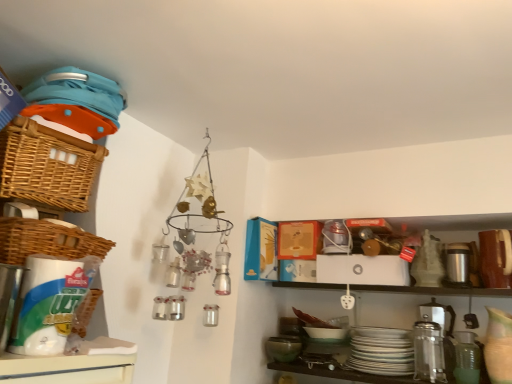
At what (x,y) coordinates should I click in order to perform the action: click on silver metallic thermos at right. Please return your answer as a coordinate pair (x, y). Looking at the image, I should click on (461, 264).

At what (x,y) coordinates should I click in order to perform the action: click on silver metallic thermos at right. Please return your answer as a coordinate pair (x, y). The image size is (512, 384). Looking at the image, I should click on (461, 264).

Is silver metallic thermos at right surrounded by woven brown basket at left, arranged as the 1th basket when ordered from the bottom?

No, silver metallic thermos at right is not a part of woven brown basket at left, arranged as the 1th basket when ordered from the bottom.

Is woven brown basket at left, the second basket positioned from the top, facing towards silver metallic thermos at right?

No, woven brown basket at left, the second basket positioned from the top, is not facing towards silver metallic thermos at right.

Considering their positions, is woven brown basket at left, the second basket positioned from the top, located in front of or behind silver metallic thermos at right?

woven brown basket at left, the second basket positioned from the top, is positioned closer to the viewer than silver metallic thermos at right.

From the image's perspective, is woven brown basket at left, the second basket positioned from the top, positioned above or below silver metallic thermos at right?

Clearly, from the image's perspective, woven brown basket at left, the second basket positioned from the top, is above silver metallic thermos at right.

Are silver metallic thermos at right and green matte mixing bowl at lower center making contact?

No, silver metallic thermos at right is not beside green matte mixing bowl at lower center.

From a real-world perspective, relative to green matte mixing bowl at lower center, is silver metallic thermos at right vertically above or below?

silver metallic thermos at right is situated higher than green matte mixing bowl at lower center in the real world.

Which of these two, silver metallic thermos at right or green matte mixing bowl at lower center, is smaller?

green matte mixing bowl at lower center.

This screenshot has width=512, height=384. Find the location of `appliance lying above the green matte mixing bowl at lower center (from the image's perspective)`. appliance lying above the green matte mixing bowl at lower center (from the image's perspective) is located at coordinates (461, 264).

Between woven brown basket at upper left, the 1th basket when ordered from top to bottom, and woven brown basket at left, arranged as the 1th basket when ordered from the bottom, which one has smaller size?

woven brown basket at left, arranged as the 1th basket when ordered from the bottom.

Locate an element on the screen. The height and width of the screenshot is (384, 512). basket above the woven brown basket at left, arranged as the 1th basket when ordered from the bottom (from the image's perspective) is located at coordinates (47, 165).

Considering the relative sizes of woven brown basket at upper left, the 1th basket when ordered from top to bottom, and woven brown basket at left, arranged as the 1th basket when ordered from the bottom, in the image provided, is woven brown basket at upper left, the 1th basket when ordered from top to bottom, shorter than woven brown basket at left, arranged as the 1th basket when ordered from the bottom,?

In fact, woven brown basket at upper left, the 1th basket when ordered from top to bottom, may be taller than woven brown basket at left, arranged as the 1th basket when ordered from the bottom.

Considering the positions of points (85, 171) and (20, 254), is point (85, 171) farther from camera compared to point (20, 254)?

Yes, point (85, 171) is farther from viewer.

Do you think woven brown basket at left, the second basket positioned from the top, is within woven brown basket at upper left, the 1th basket when ordered from top to bottom, or outside of it?

woven brown basket at left, the second basket positioned from the top, exists outside the volume of woven brown basket at upper left, the 1th basket when ordered from top to bottom.

Looking at this image, what's the angular difference between woven brown basket at left, arranged as the 1th basket when ordered from the bottom, and woven brown basket at upper left, marked as the second basket in a bottom-to-top arrangement,'s facing directions?

They differ by 0.000455 degrees in their facing directions.

From a real-world perspective, is woven brown basket at left, arranged as the 1th basket when ordered from the bottom, positioned over woven brown basket at upper left, the 1th basket when ordered from top to bottom, based on gravity?

No, from a real-world perspective, woven brown basket at left, arranged as the 1th basket when ordered from the bottom, is not above woven brown basket at upper left, the 1th basket when ordered from top to bottom.

Find the location of a particular element. basket lying on the left of woven brown basket at left, arranged as the 1th basket when ordered from the bottom is located at coordinates (47, 165).

Is green matte mixing bowl at lower center located outside silver metallic thermos at right?

Yes, green matte mixing bowl at lower center is outside of silver metallic thermos at right.

Can you confirm if green matte mixing bowl at lower center is taller than silver metallic thermos at right?

No, green matte mixing bowl at lower center is not taller than silver metallic thermos at right.

Can you confirm if woven brown basket at left, arranged as the 1th basket when ordered from the bottom, is wider than green matte mixing bowl at lower center?

Correct, the width of woven brown basket at left, arranged as the 1th basket when ordered from the bottom, exceeds that of green matte mixing bowl at lower center.

How different are the orientations of woven brown basket at left, the second basket positioned from the top, and green matte mixing bowl at lower center in degrees?

The angle between the facing direction of woven brown basket at left, the second basket positioned from the top, and the facing direction of green matte mixing bowl at lower center is 85 degrees.

From a real-world perspective, between woven brown basket at left, the second basket positioned from the top, and green matte mixing bowl at lower center, who is vertically lower?

In real-world perspective, green matte mixing bowl at lower center is lower.

Considering the relative positions of woven brown basket at left, arranged as the 1th basket when ordered from the bottom, and green matte mixing bowl at lower center in the image provided, is woven brown basket at left, arranged as the 1th basket when ordered from the bottom, to the left or to the right of green matte mixing bowl at lower center?

From the image, it's evident that woven brown basket at left, arranged as the 1th basket when ordered from the bottom, is to the left of green matte mixing bowl at lower center.

Can you confirm if woven brown basket at upper left, marked as the second basket in a bottom-to-top arrangement, is thinner than silver metallic thermos at right?

No.

From the image's perspective, is woven brown basket at upper left, the 1th basket when ordered from top to bottom, beneath silver metallic thermos at right?

No.

From the picture: Between woven brown basket at upper left, marked as the second basket in a bottom-to-top arrangement, and silver metallic thermos at right, which one appears on the left side from the viewer's perspective?

woven brown basket at upper left, marked as the second basket in a bottom-to-top arrangement, is more to the left.

Considering the points (78, 144) and (453, 250), which point is in front, point (78, 144) or point (453, 250)?

The point (78, 144) is more forward.

Find the location of `appliance that appears behind the woven brown basket at left, arranged as the 1th basket when ordered from the bottom`. appliance that appears behind the woven brown basket at left, arranged as the 1th basket when ordered from the bottom is located at coordinates (461, 264).

Find the location of a particular element. This screenshot has height=384, width=512. mixing bowl on the left of silver metallic thermos at right is located at coordinates (283, 348).

Which object lies nearer to the anchor point woven brown basket at left, the second basket positioned from the top, woven brown basket at upper left, marked as the second basket in a bottom-to-top arrangement, or green matte mixing bowl at lower center?

Result: Based on the image, woven brown basket at upper left, marked as the second basket in a bottom-to-top arrangement, appears to be nearer to woven brown basket at left, the second basket positioned from the top.

From the image, which object appears to be farther from silver metallic thermos at right, woven brown basket at left, arranged as the 1th basket when ordered from the bottom, or green matte mixing bowl at lower center?

The object further to silver metallic thermos at right is woven brown basket at left, arranged as the 1th basket when ordered from the bottom.

Which object lies nearer to the anchor point woven brown basket at left, arranged as the 1th basket when ordered from the bottom, woven brown basket at upper left, marked as the second basket in a bottom-to-top arrangement, or silver metallic thermos at right?

woven brown basket at upper left, marked as the second basket in a bottom-to-top arrangement, is positioned closer to the anchor woven brown basket at left, arranged as the 1th basket when ordered from the bottom.

Consider the image. From the image, which object appears to be farther from woven brown basket at left, arranged as the 1th basket when ordered from the bottom, green matte mixing bowl at lower center or silver metallic thermos at right?

silver metallic thermos at right lies further to woven brown basket at left, arranged as the 1th basket when ordered from the bottom, than the other object.

Estimate the real-world distances between objects in this image. Which object is closer to woven brown basket at left, arranged as the 1th basket when ordered from the bottom, silver metallic thermos at right or green matte mixing bowl at lower center?

green matte mixing bowl at lower center lies closer to woven brown basket at left, arranged as the 1th basket when ordered from the bottom, than the other object.

Estimate the real-world distances between objects in this image. Which object is closer to woven brown basket at upper left, marked as the second basket in a bottom-to-top arrangement, woven brown basket at left, the second basket positioned from the top, or green matte mixing bowl at lower center?

Based on the image, woven brown basket at left, the second basket positioned from the top, appears to be nearer to woven brown basket at upper left, marked as the second basket in a bottom-to-top arrangement.

Estimate the real-world distances between objects in this image. Which object is closer to green matte mixing bowl at lower center, woven brown basket at left, arranged as the 1th basket when ordered from the bottom, or silver metallic thermos at right?

silver metallic thermos at right is positioned closer to the anchor green matte mixing bowl at lower center.

In the scene shown: Which object lies further to the anchor point green matte mixing bowl at lower center, woven brown basket at upper left, the 1th basket when ordered from top to bottom, or silver metallic thermos at right?

woven brown basket at upper left, the 1th basket when ordered from top to bottom, is further to green matte mixing bowl at lower center.

Locate an element on the screen. The image size is (512, 384). basket situated between woven brown basket at upper left, the 1th basket when ordered from top to bottom, and silver metallic thermos at right from left to right is located at coordinates (46, 241).

Image resolution: width=512 pixels, height=384 pixels. In order to click on mixing bowl situated between woven brown basket at upper left, the 1th basket when ordered from top to bottom, and silver metallic thermos at right from left to right in this screenshot , I will do `click(283, 348)`.

The height and width of the screenshot is (384, 512). Identify the location of basket between woven brown basket at upper left, the 1th basket when ordered from top to bottom, and green matte mixing bowl at lower center. (46, 241).

You are a GUI agent. You are given a task and a screenshot of the screen. Output one action in this format:
    pyautogui.click(x=<x>, y=<y>)
    Task: Click on the mixing bowl between woven brown basket at left, the second basket positioned from the top, and silver metallic thermos at right, in the horizontal direction
    
    Given the screenshot: What is the action you would take?
    pyautogui.click(x=283, y=348)